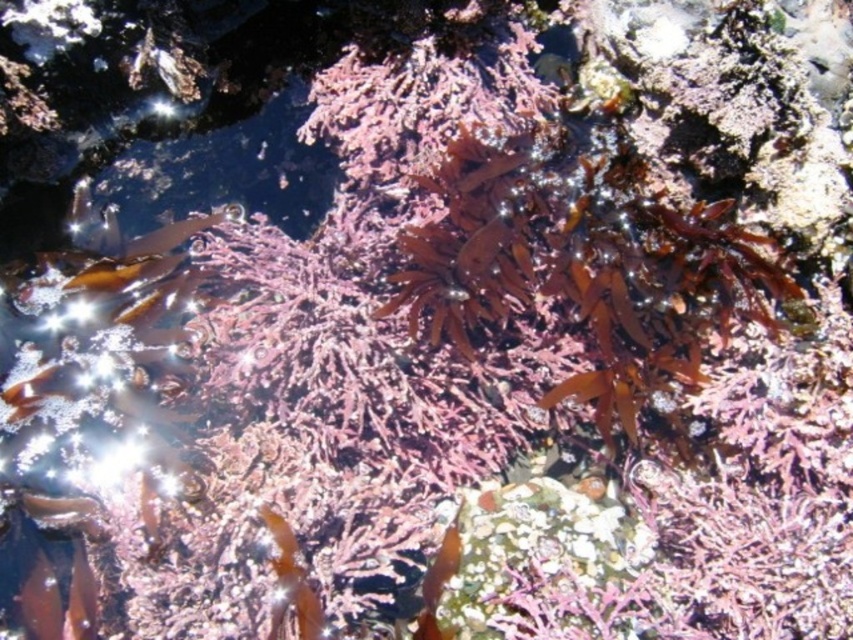
Does shiny orange fish at bottom left have a greater height compared to translucent brown seaweed at lower left?

No.

Find the location of `shiny orange fish at bottom left`. shiny orange fish at bottom left is located at coordinates (39, 602).

Image resolution: width=853 pixels, height=640 pixels. What do you see at coordinates (39, 602) in the screenshot?
I see `shiny orange fish at bottom left` at bounding box center [39, 602].

Where is `shiny orange fish at bottom left`? This screenshot has height=640, width=853. shiny orange fish at bottom left is located at coordinates (39, 602).